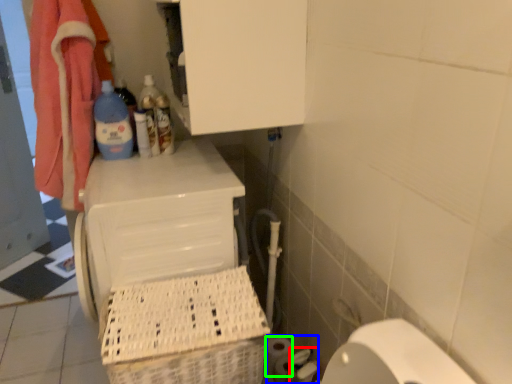
Question: Based on their relative distances, which object is nearer to toilet paper (highlighted by a red box)? Choose from toilet paper (highlighted by a blue box) and toilet paper (highlighted by a green box).

Choices:
 (A) toilet paper
 (B) toilet paper

Answer: (A)